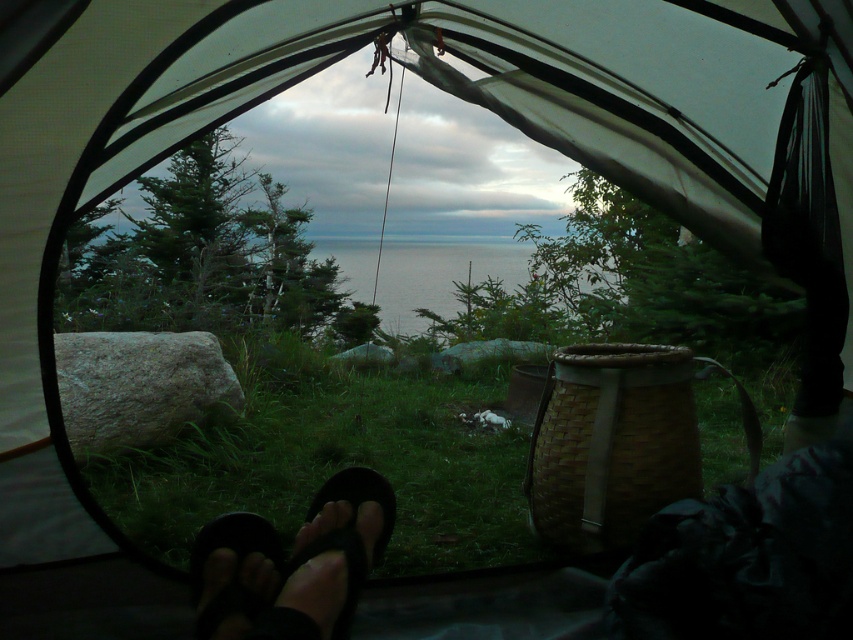
You are inside a tent and see your footwear at the bottom of the tent. You need to choose between the black rubber sandals at lower center and the black matte sandal at lower center for a short hike. Which pair is wider?

The black rubber sandals at lower center are wider than the black matte sandal at lower center.

You are inside a tent and want to check the distance between the point at coordinate [234,566] and the large rock on the left. Can you tell me which object is closer to you?

The point at coordinate [234,566] is on the black rubber flip flop at lower left, so it is closer to you than the large rock on the left which is outside the tent.